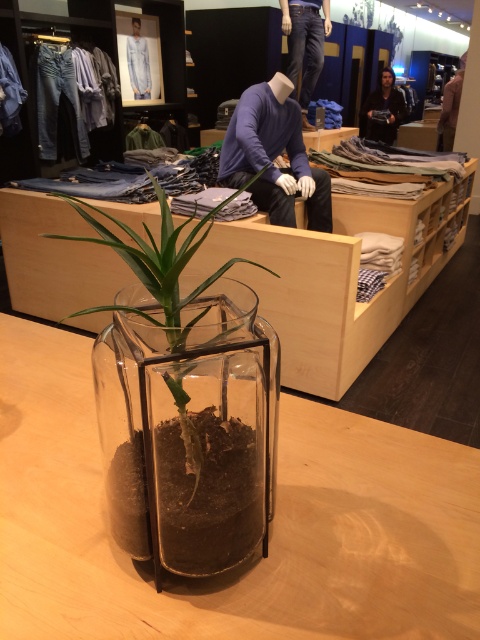
You are standing in the clothing store and want to place a new price tag between the two points, point [39,397] and point [445,129]. Based on their positions, where should you position the price tag so it is closer to the point that is in front?

The price tag should be placed closer to point [39,397] because it is in front of point [445,129].

You are standing in the center of the clothing store and want to place a new display stand exactly at the transparent glass table at center. What are the coordinates where you should place it?

The transparent glass table at center is located at coordinates point (x=272, y=531), so you should place the display stand there.